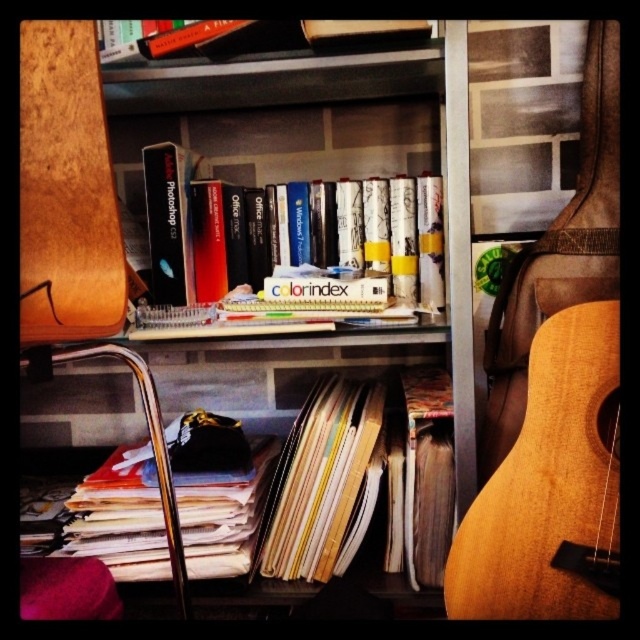
Is white paper stack at lower left wider than wooden bookcase at upper center?

Yes, white paper stack at lower left is wider than wooden bookcase at upper center.

Does white paper stack at lower left have a lesser height compared to wooden bookcase at upper center?

Yes.

Is point (144, 458) positioned before point (99, 109)?

No, (144, 458) is behind (99, 109).

Identify the location of white paper stack at lower left. (298, 493).

Is white matte book at center bigger than wooden bookcase at upper center?

Correct, white matte book at center is larger in size than wooden bookcase at upper center.

Is point (381, 195) farther from camera compared to point (64, 211)?

Yes, it is.

Where is `white matte book at center`? white matte book at center is located at coordinates (300, 237).

Can you confirm if white paper stack at lower left is shorter than white matte book at center?

No, white paper stack at lower left is not shorter than white matte book at center.

Who is lower down, white paper stack at lower left or white matte book at center?

Positioned lower is white paper stack at lower left.

Which is in front, point (336, 486) or point (330, 268)?

Positioned in front is point (336, 486).

The height and width of the screenshot is (640, 640). Find the location of `white paper stack at lower left`. white paper stack at lower left is located at coordinates (298, 493).